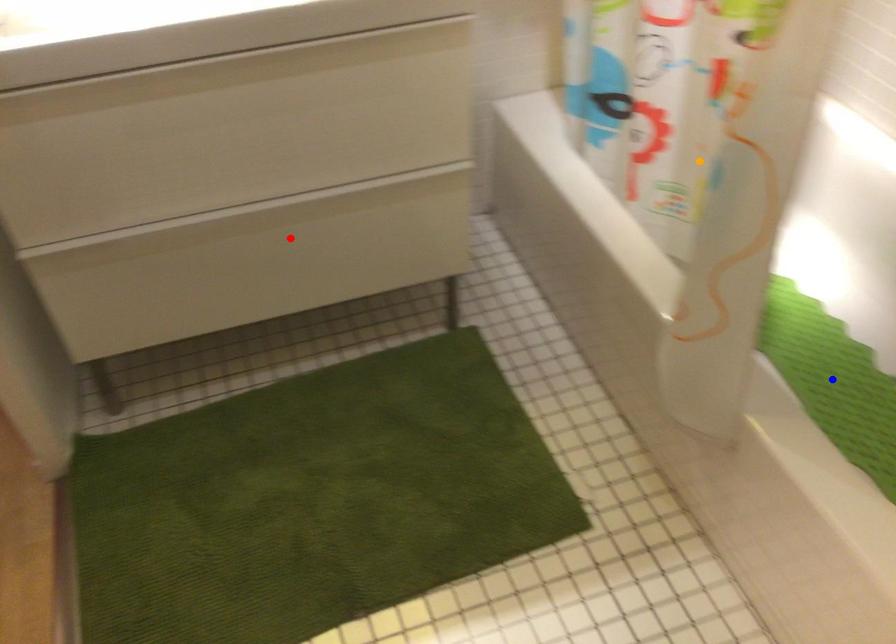
Order these from nearest to farthest:
red point
orange point
blue point

orange point → red point → blue point